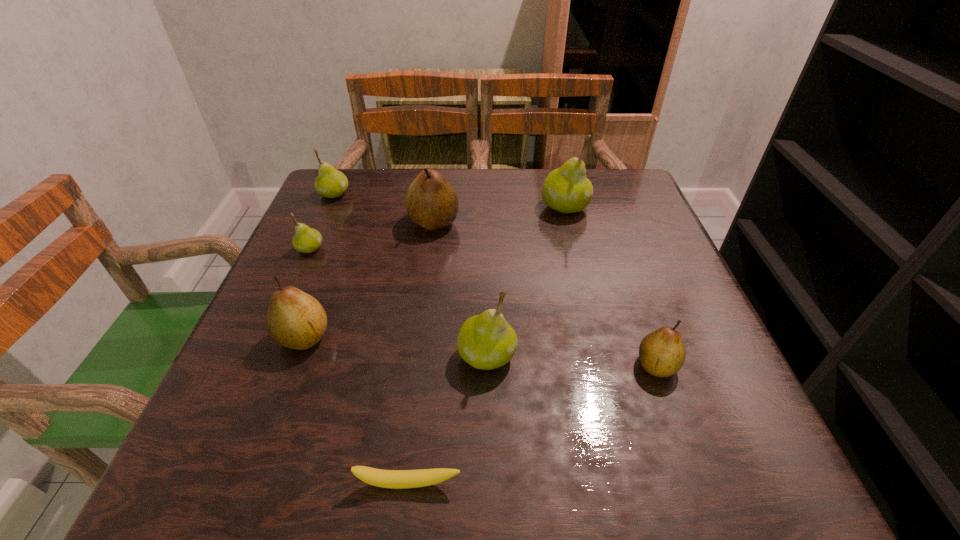
Locate an element on the screen. This screenshot has height=540, width=960. free location at the near right corner of the desktop is located at coordinates (726, 464).

Locate an element on the screen. This screenshot has height=540, width=960. vacant point located between the third green pear from left to right and the rightmost green pear is located at coordinates (526, 281).

This screenshot has height=540, width=960. Identify the location of empty location between the farthest brown pear and the second smallest brown pear. (369, 280).

I want to click on vacant space that is in between the banana and the fourth pear from right to left, so click(420, 353).

Identify the location of vacant region between the third farthest green pear and the second brown pear from right to left. (372, 235).

Where is `vacant space that's between the rightmost brown pear and the second biggest green pear`? vacant space that's between the rightmost brown pear and the second biggest green pear is located at coordinates (572, 361).

Identify the location of vacant area between the rightmost brown pear and the nearest object. The height and width of the screenshot is (540, 960). (532, 424).

This screenshot has width=960, height=540. Find the location of `free space between the second brown pear from right to left and the rightmost brown pear`. free space between the second brown pear from right to left and the rightmost brown pear is located at coordinates (545, 294).

Where is `free space between the tallest pear and the farthest brown pear`? The height and width of the screenshot is (540, 960). free space between the tallest pear and the farthest brown pear is located at coordinates (499, 214).

Identify which object is the fourth nearest to the fourth nearest pear. Please provide its 2D coordinates. Your answer should be formatted as a tuple, i.e. [(x, y)], where the tuple contains the x and y coordinates of a point satisfying the conditions above.

[(487, 341)]